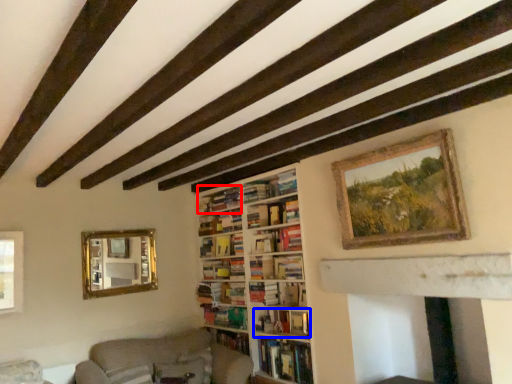
Question: Among these objects, which one is nearest to the camera, book (highlighted by a red box) or book (highlighted by a blue box)?

Choices:
 (A) book
 (B) book

Answer: (B)